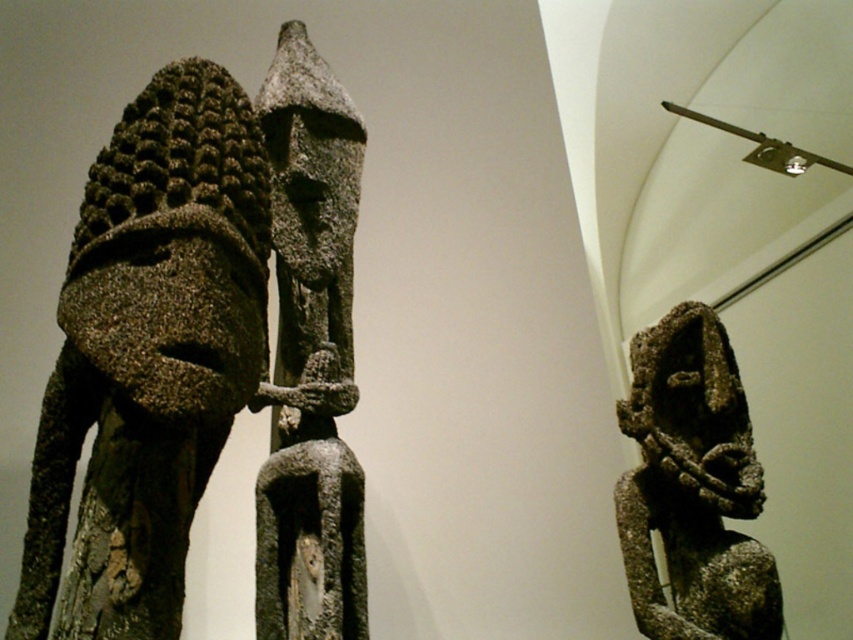
You are an art conservator assessing the space between two central statues in the museum. You need to place a protective barrier between the rough stone statue at center and the rusty stone figure at center. The barrier requires a minimum of 1 meter of space. Can you determine if there is enough space between them?

The rough stone statue at center is larger in size than the rusty stone figure at center, but the exact distance between them isn t specified. Without knowing the actual spacing, I can t confirm if there s sufficient room for the barrier.

You are a museum curator arranging an exhibition. You have two objects in the center area of the display space. One is a rough stone mask at center and the other is a rough stone statue at center. According to the spatial arrangement, which one is located to the right of the other?

The rough stone mask at center is positioned on the right side of the rough stone statue at center, so the rough stone mask at center is to the right of the rough stone statue at center.

You are a museum curator planning to install a protective glass case around the rough stone statue at center and the rusty stone figure at center. The glass case can only accommodate objects up to 2 meters in height. Based on the description, will both statues fit inside the case?

The rough stone statue at center is taller than the rusty stone figure at center. Since the glass case can only accommodate up to 2 meters in height, we need to know the exact height of the taller statue to determine if both will fit. However, the description only states that the rough stone statue at center is taller than the rusty stone figure at center, but does not provide specific measurements. Therefore, it is uncertain whether both will fit without additional information.